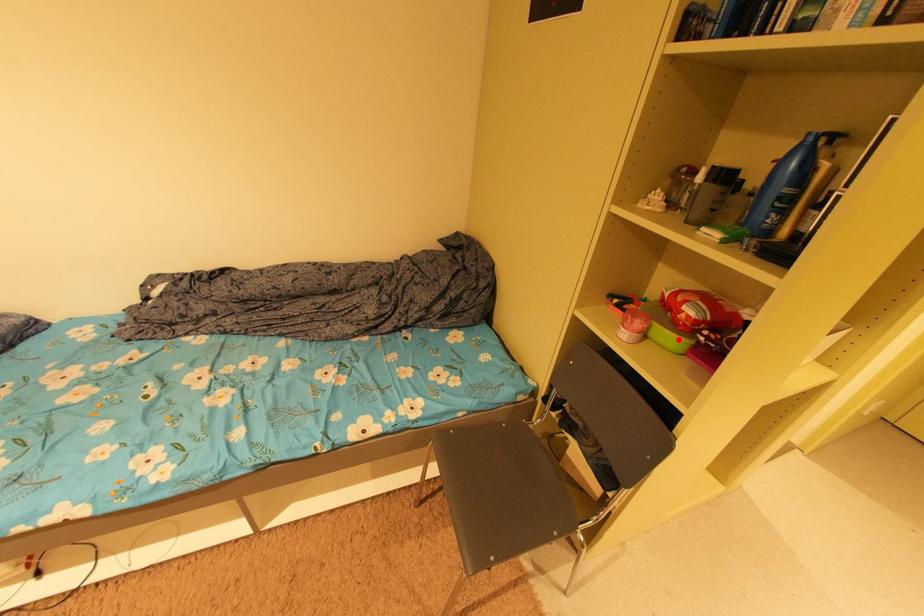
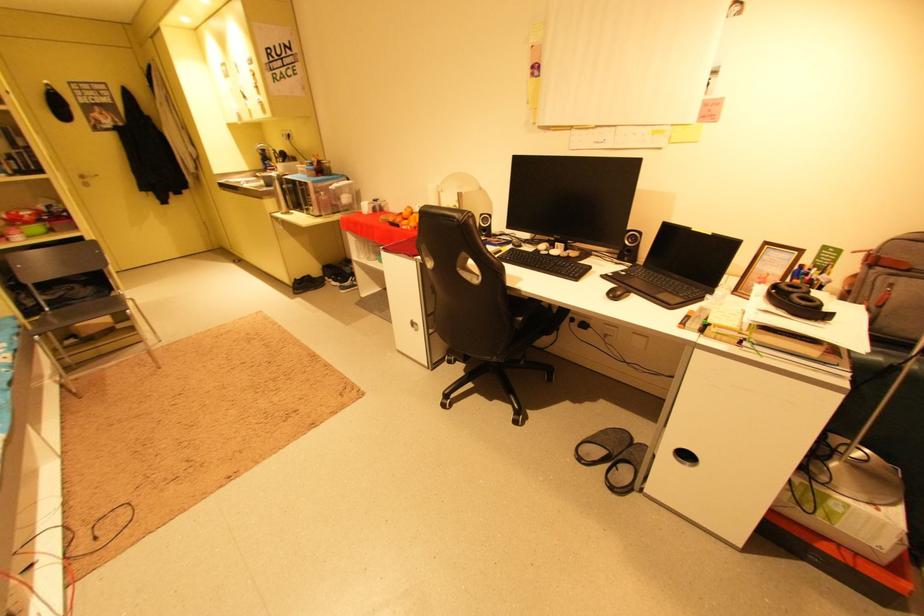
Find the pixel in the second image that matches the highlighted location in the first image.

(43, 229)